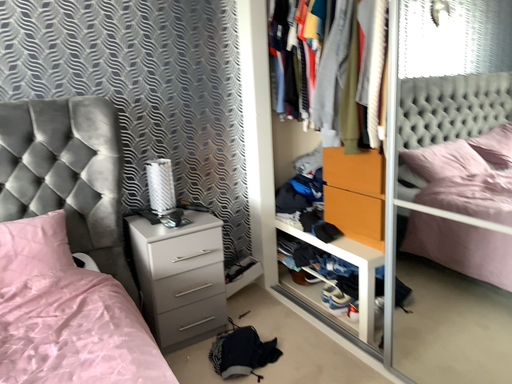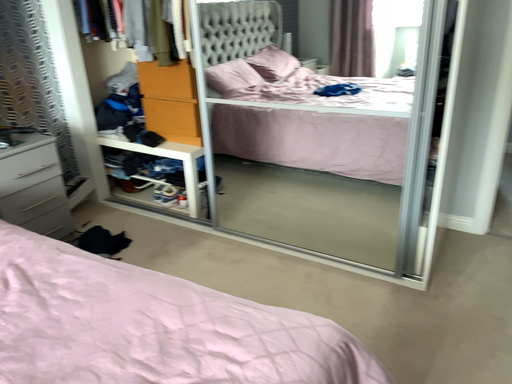
Question: How did the camera likely rotate when shooting the video?

Choices:
 (A) rotated right
 (B) rotated left

Answer: (A)